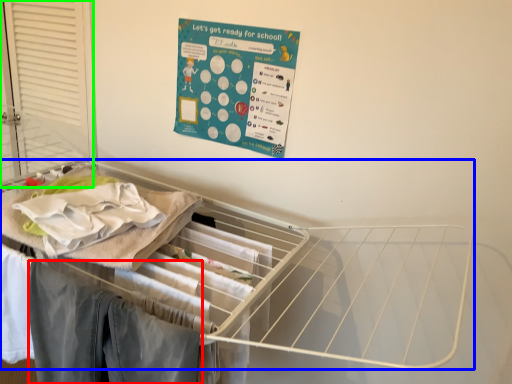
Question: Based on their relative distances, which object is farther from clothing (highlighted by a red box)? Choose from furniture (highlighted by a blue box) and screen door (highlighted by a green box).

Choices:
 (A) furniture
 (B) screen door

Answer: (B)